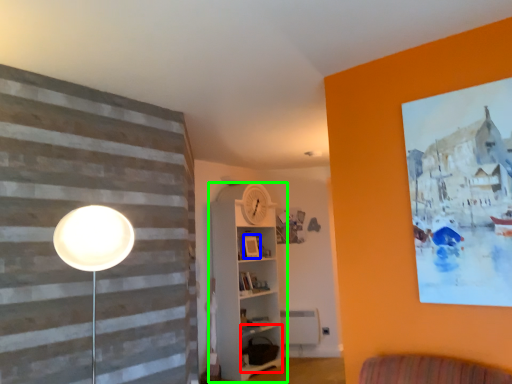
Question: Considering the real-world distances, which object is closest to shelf (highlighted by a red box)? picture frame (highlighted by a blue box) or shelf (highlighted by a green box).

Choices:
 (A) picture frame
 (B) shelf

Answer: (B)